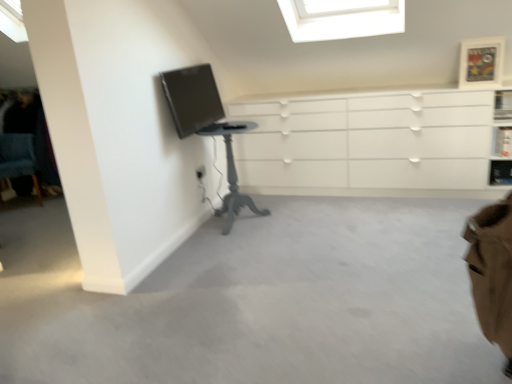
Describe the element at coordinates (342, 18) in the screenshot. I see `transparent glass skylight at upper center` at that location.

In order to click on white glossy shelf at upper right, the second shelf ordered from the bottom in this screenshot , I will do `click(502, 142)`.

At what (x,y) coordinates should I click in order to perform the action: click on wooden picture frame at upper right. Please return your answer as a coordinate pair (x, y). This screenshot has height=384, width=512. Looking at the image, I should click on (481, 63).

Where is `matte black monitor at upper left`? The height and width of the screenshot is (384, 512). matte black monitor at upper left is located at coordinates (192, 98).

From the picture: In order to face white matte chest of drawers at center, should I rotate leftwards or rightwards?

A 14.430 degree turn to the right will do.

The width and height of the screenshot is (512, 384). I want to click on metallic silver shelf at upper right, arranged as the first shelf when ordered from the bottom, so click(x=500, y=172).

How much space does metallic silver shelf at upper right, which is counted as the 2th shelf, starting from the top, occupy horizontally?

metallic silver shelf at upper right, which is counted as the 2th shelf, starting from the top, is 7.73 inches wide.

Identify the location of transparent glass skylight at upper center. The height and width of the screenshot is (384, 512). (342, 18).

Can you confirm if brown fabric swivel chair at lower right is bigger than white glossy shelf at upper right, placed as the 1th shelf when sorted from top to bottom?

Yes, brown fabric swivel chair at lower right is bigger than white glossy shelf at upper right, placed as the 1th shelf when sorted from top to bottom.

Choose the correct answer: Is brown fabric swivel chair at lower right inside white glossy shelf at upper right, placed as the 1th shelf when sorted from top to bottom, or outside it?

brown fabric swivel chair at lower right is not inside white glossy shelf at upper right, placed as the 1th shelf when sorted from top to bottom, it's outside.

Where is `the 2nd shelf positioned above the brown fabric swivel chair at lower right (from the image's perspective)`? This screenshot has height=384, width=512. the 2nd shelf positioned above the brown fabric swivel chair at lower right (from the image's perspective) is located at coordinates (502, 142).

Is brown fabric swivel chair at lower right turned away from white glossy shelf at upper right, the second shelf ordered from the bottom?

No, brown fabric swivel chair at lower right is not facing the opposite direction of white glossy shelf at upper right, the second shelf ordered from the bottom.

Is point (18, 148) farther from viewer compared to point (311, 40)?

That is True.

Is blue fabric chair at lower left aimed at transparent glass skylight at upper center?

No, blue fabric chair at lower left does not turn towards transparent glass skylight at upper center.

Considering the relative positions of blue fabric chair at lower left and transparent glass skylight at upper center in the image provided, is blue fabric chair at lower left to the left of transparent glass skylight at upper center from the viewer's perspective?

Yes.

Can you tell me how much white matte chest of drawers at center and matte black monitor at upper left differ in facing direction?

There is a 89.9-degree angle between the facing directions of white matte chest of drawers at center and matte black monitor at upper left.

Who is smaller, white matte chest of drawers at center or matte black monitor at upper left?

With smaller size is matte black monitor at upper left.

Is point (356, 180) more distant than point (200, 126)?

Yes, point (356, 180) is behind point (200, 126).

From the image's perspective, who appears lower, white matte chest of drawers at center or matte black monitor at upper left?

white matte chest of drawers at center appears lower in the image.

Would you say transparent glass skylight at upper center is inside or outside wooden picture frame at upper right?

The correct answer is: outside.

Considering the positions of points (395, 26) and (487, 37), is point (395, 26) closer to camera compared to point (487, 37)?

No, (395, 26) is further to viewer.

How many degrees apart are the facing directions of transparent glass skylight at upper center and wooden picture frame at upper right?

The angle between the facing direction of transparent glass skylight at upper center and the facing direction of wooden picture frame at upper right is 1.66 degrees.

Is transparent glass skylight at upper center positioned far away from wooden picture frame at upper right?

No, transparent glass skylight at upper center is not far from wooden picture frame at upper right.

Considering the sizes of objects metallic silver shelf at upper right, which is counted as the 2th shelf, starting from the top, and white matte chest of drawers at center in the image provided, who is smaller, metallic silver shelf at upper right, which is counted as the 2th shelf, starting from the top, or white matte chest of drawers at center?

metallic silver shelf at upper right, which is counted as the 2th shelf, starting from the top.

Which is behind, metallic silver shelf at upper right, arranged as the first shelf when ordered from the bottom, or white matte chest of drawers at center?

metallic silver shelf at upper right, arranged as the first shelf when ordered from the bottom, is further away from the camera.

How many degrees apart are the facing directions of metallic silver shelf at upper right, which is counted as the 2th shelf, starting from the top, and white matte chest of drawers at center?

5.97 degrees separate the facing orientations of metallic silver shelf at upper right, which is counted as the 2th shelf, starting from the top, and white matte chest of drawers at center.

Considering the relative sizes of metallic silver shelf at upper right, which is counted as the 2th shelf, starting from the top, and white matte chest of drawers at center in the image provided, is metallic silver shelf at upper right, which is counted as the 2th shelf, starting from the top, thinner than white matte chest of drawers at center?

Yes, metallic silver shelf at upper right, which is counted as the 2th shelf, starting from the top, is thinner than white matte chest of drawers at center.

Considering the relative sizes of matte black monitor at upper left and transparent glass skylight at upper center in the image provided, is matte black monitor at upper left taller than transparent glass skylight at upper center?

Indeed, matte black monitor at upper left has a greater height compared to transparent glass skylight at upper center.

Does point (182, 97) come in front of point (298, 3)?

Yes, point (182, 97) is closer to viewer.

From a real-world perspective, which is physically above, matte black monitor at upper left or transparent glass skylight at upper center?

transparent glass skylight at upper center, from a real-world perspective.

Between white glossy shelf at upper right, the second shelf ordered from the bottom, and metallic silver shelf at upper right, arranged as the first shelf when ordered from the bottom, which one has smaller size?

With smaller size is metallic silver shelf at upper right, arranged as the first shelf when ordered from the bottom.

Is white glossy shelf at upper right, placed as the 1th shelf when sorted from top to bottom, to the left of metallic silver shelf at upper right, which is counted as the 2th shelf, starting from the top, from the viewer's perspective?

Yes.

In the scene shown: Is white glossy shelf at upper right, placed as the 1th shelf when sorted from top to bottom, positioned behind metallic silver shelf at upper right, arranged as the first shelf when ordered from the bottom?

No, it is in front of metallic silver shelf at upper right, arranged as the first shelf when ordered from the bottom.

From the image's perspective, is white glossy shelf at upper right, the second shelf ordered from the bottom, located above or below metallic silver shelf at upper right, which is counted as the 2th shelf, starting from the top?

Clearly, from the image's perspective, white glossy shelf at upper right, the second shelf ordered from the bottom, is above metallic silver shelf at upper right, which is counted as the 2th shelf, starting from the top.

The width and height of the screenshot is (512, 384). Identify the location of swivel chair that is above the white glossy shelf at upper right, placed as the 1th shelf when sorted from top to bottom (from a real-world perspective). (492, 273).

Identify the location of window to the right of blue fabric chair at lower left. Image resolution: width=512 pixels, height=384 pixels. (342, 18).

Considering their positions, is matte black monitor at upper left positioned closer to wooden picture frame at upper right than white glossy shelf at upper right, placed as the 1th shelf when sorted from top to bottom?

white glossy shelf at upper right, placed as the 1th shelf when sorted from top to bottom.

Looking at the image, which one is located closer to transparent glass skylight at upper center, blue fabric chair at lower left or matte black monitor at upper left?

Among the two, matte black monitor at upper left is located nearer to transparent glass skylight at upper center.

When comparing their distances from blue fabric chair at lower left, does wooden picture frame at upper right or gray painted wood table at left seem further?

The object further to blue fabric chair at lower left is wooden picture frame at upper right.

When comparing their distances from brown fabric swivel chair at lower right, does transparent glass skylight at upper center or white glossy shelf at upper right, the second shelf ordered from the bottom, seem closer?

transparent glass skylight at upper center is positioned closer to the anchor brown fabric swivel chair at lower right.

From the image, which object appears to be nearer to gray painted wood table at left, blue fabric chair at lower left or wooden picture frame at upper right?

wooden picture frame at upper right lies closer to gray painted wood table at left than the other object.

From the image, which object appears to be nearer to gray painted wood table at left, brown fabric swivel chair at lower right or transparent glass skylight at upper center?

transparent glass skylight at upper center is positioned closer to the anchor gray painted wood table at left.

Looking at the image, which one is located further to matte black monitor at upper left, white glossy shelf at upper right, the second shelf ordered from the bottom, or transparent glass skylight at upper center?

white glossy shelf at upper right, the second shelf ordered from the bottom, is positioned further to the anchor matte black monitor at upper left.

Based on their spatial positions, is blue fabric chair at lower left or brown fabric swivel chair at lower right further from white matte chest of drawers at center?

blue fabric chair at lower left lies further to white matte chest of drawers at center than the other object.

The width and height of the screenshot is (512, 384). What are the coordinates of `window located between gray painted wood table at left and wooden picture frame at upper right in the left-right direction` in the screenshot? It's located at (342, 18).

Locate an element on the screen. This screenshot has height=384, width=512. table between matte black monitor at upper left and wooden picture frame at upper right from left to right is located at coordinates (232, 172).

Identify the location of the chest of drawers situated between matte black monitor at upper left and wooden picture frame at upper right from left to right. (368, 144).

Where is `swivel chair located between matte black monitor at upper left and white glossy shelf at upper right, the second shelf ordered from the bottom, in the left-right direction`? swivel chair located between matte black monitor at upper left and white glossy shelf at upper right, the second shelf ordered from the bottom, in the left-right direction is located at coordinates (492, 273).